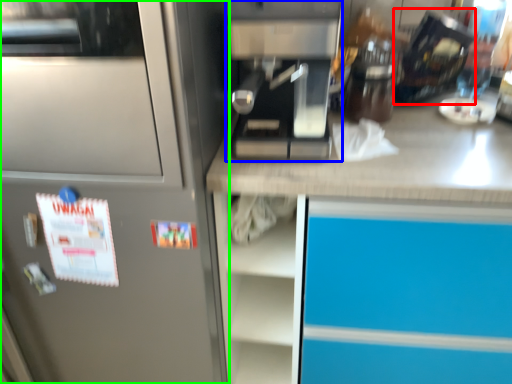
Question: Which object is the closest to the appliance (highlighted by a red box)? Choose among these: kitchen appliance (highlighted by a blue box) or home appliance (highlighted by a green box).

Choices:
 (A) kitchen appliance
 (B) home appliance

Answer: (A)